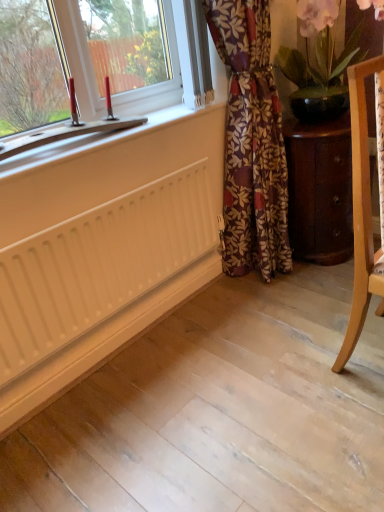
Question: From a real-world perspective, is wooden cabinet at lower right positioned above or below matte black pot at upper right?

Choices:
 (A) above
 (B) below

Answer: (B)

Question: Is wooden cabinet at lower right spatially inside matte black pot at upper right, or outside of it?

Choices:
 (A) outside
 (B) inside

Answer: (A)

Question: Estimate the real-world distances between objects in this image. Which object is farther from the wooden cabinet at lower right?

Choices:
 (A) floral fabric curtain at center
 (B) matte black pot at upper right
 (C) light wood chair at right
 (D) white matte radiator at lower left

Answer: (D)

Question: Which is farther from the wooden cabinet at lower right?

Choices:
 (A) light wood chair at right
 (B) white matte radiator at lower left
 (C) floral fabric curtain at center
 (D) matte black pot at upper right

Answer: (B)